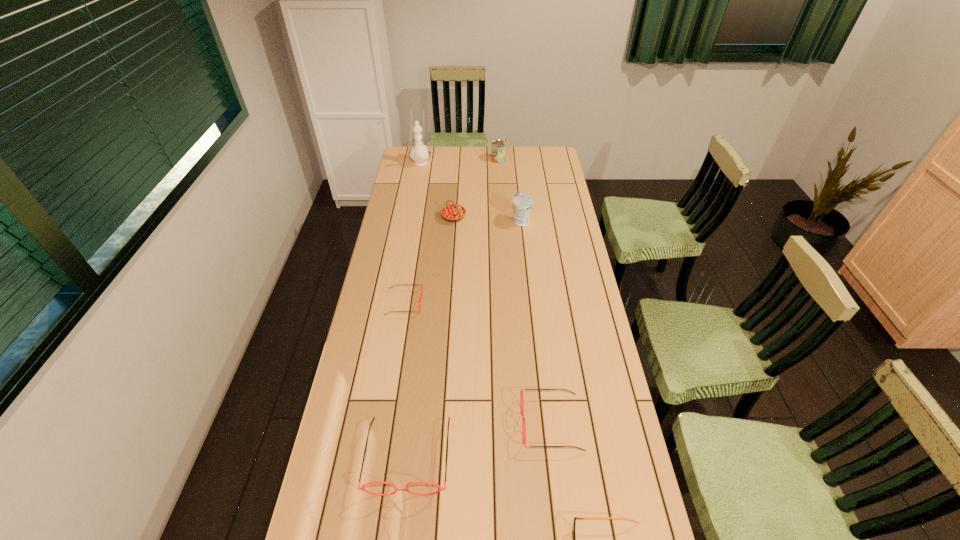
Locate an element on the screen. The image size is (960, 540). the tallest object is located at coordinates (419, 153).

Identify the location of can. Image resolution: width=960 pixels, height=540 pixels. (498, 154).

Where is `the third tallest object`? The height and width of the screenshot is (540, 960). the third tallest object is located at coordinates (523, 203).

You are a GUI agent. You are given a task and a screenshot of the screen. Output one action in this format:
    pyautogui.click(x=<x>, y=<y>)
    Task: Click on the blue yogurt
    This screenshot has height=540, width=960.
    Given the screenshot: What is the action you would take?
    pyautogui.click(x=523, y=203)

I want to click on strawberry, so click(x=453, y=212).

Where is `the biggest red spectacles`? This screenshot has height=540, width=960. the biggest red spectacles is located at coordinates (362, 488).

Where is `the third shortest object`? The image size is (960, 540). the third shortest object is located at coordinates (521, 398).

This screenshot has height=540, width=960. I want to click on the second tallest spectacles, so click(x=521, y=398).

Where is `the smallest red spectacles`? This screenshot has height=540, width=960. the smallest red spectacles is located at coordinates (420, 297).

Identify the location of the fifth farthest object. This screenshot has height=540, width=960. (420, 297).